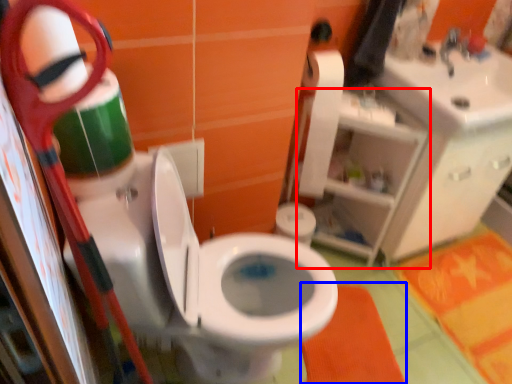
Question: Which of the following is the farthest to the observer, shelf (highlighted by a red box) or bath mat (highlighted by a blue box)?

Choices:
 (A) shelf
 (B) bath mat

Answer: (B)